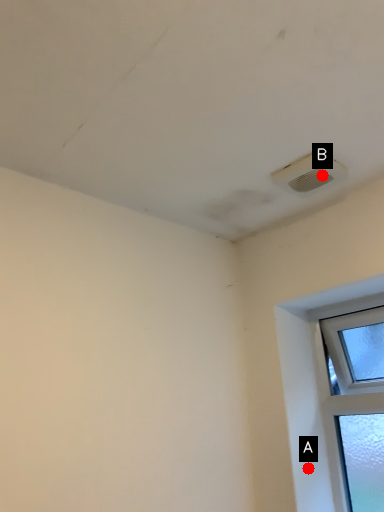
Question: Two points are circled on the image, labeled by A and B beside each circle. Which point is farther to the camera?

Choices:
 (A) A is further
 (B) B is further

Answer: (A)